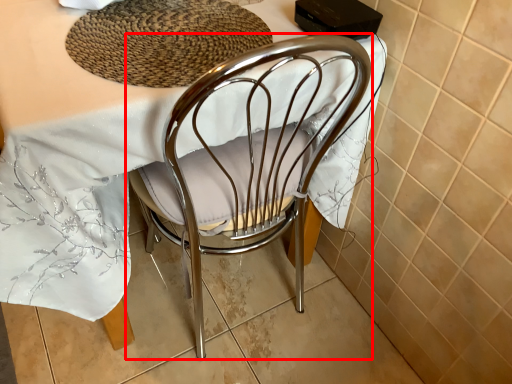
Question: From the image's perspective, where is chair (annotated by the red box) located in relation to mat in the image?

Choices:
 (A) below
 (B) above

Answer: (A)